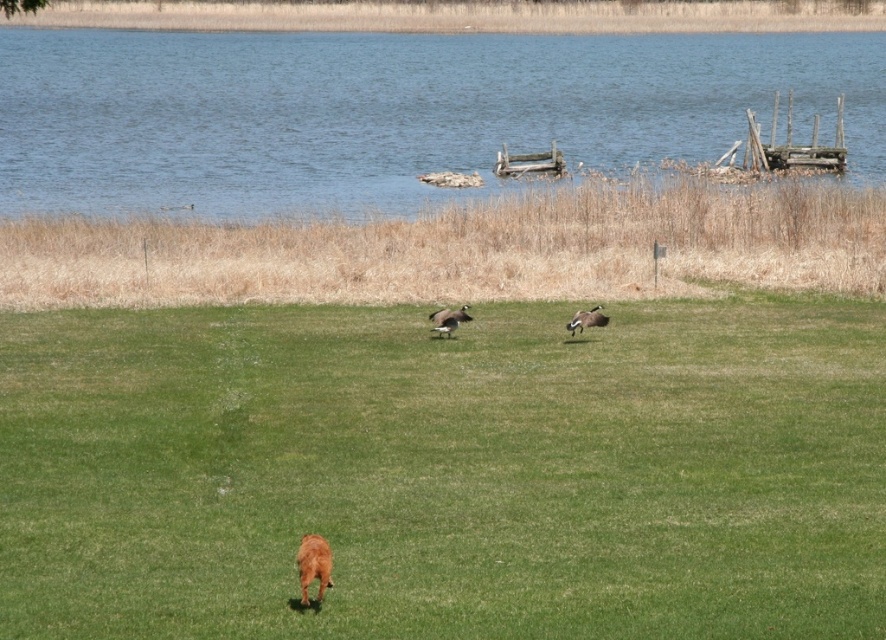
Question: Which of the following is the farthest from the observer?

Choices:
 (A) green grassy field at center
 (B) blue water at upper center

Answer: (B)

Question: Can you confirm if green grassy field at center is positioned below brown matte duck at center?

Choices:
 (A) no
 (B) yes

Answer: (B)

Question: Among these points, which one is nearest to the camera?

Choices:
 (A) (464, 316)
 (B) (597, 321)
 (C) (806, 44)

Answer: (A)

Question: Can you confirm if brown matte duck at center is bigger than brown glossy duck at center?

Choices:
 (A) no
 (B) yes

Answer: (B)

Question: Which point appears closest to the camera in this image?

Choices:
 (A) (463, 308)
 (B) (604, 323)
 (C) (28, 577)

Answer: (C)

Question: Is blue water at upper center in front of brown glossy duck at center?

Choices:
 (A) yes
 (B) no

Answer: (B)